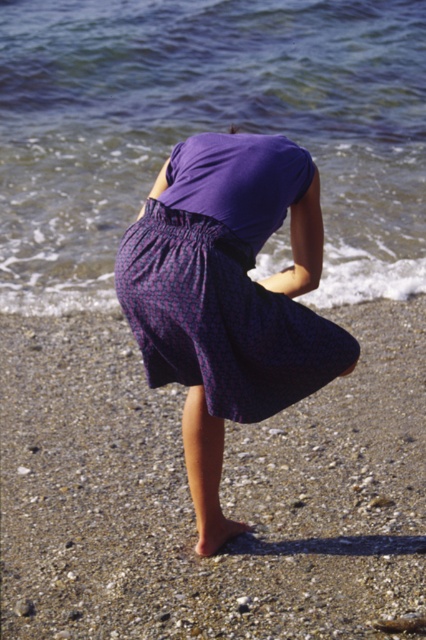
You are a beachcomber searching for seashells. You have to decide where to look first between the smooth pebbled sand at lower center and the clear water at lower left. Based on the space they occupy, which area should you prioritize?

The clear water at lower left occupies more space than the smooth pebbled sand at lower center, so you should prioritize searching the clear water at lower left first.